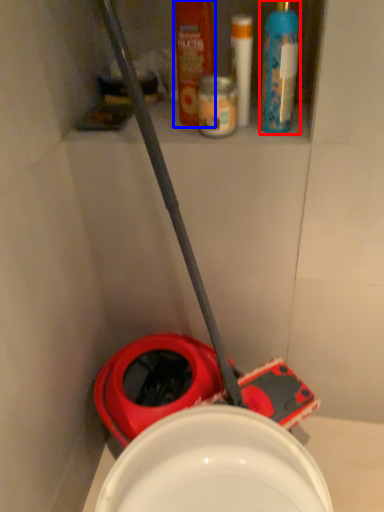
Question: Which of the following is the closest to the observer, cleaning product (highlighted by a red box) or mouthwash (highlighted by a blue box)?

Choices:
 (A) cleaning product
 (B) mouthwash

Answer: (A)